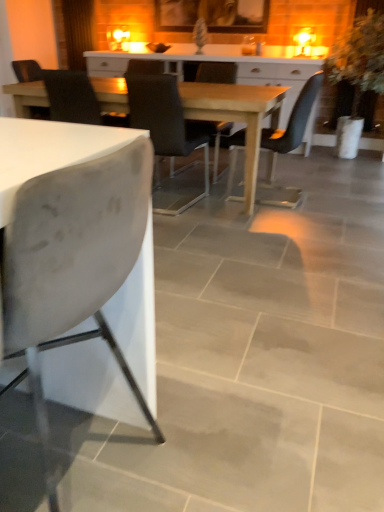
Question: From a real-world perspective, is white matte chair at left, which ranks as the 5th chair in back-to-front order, over velvet black chair at center, placed as the 4th chair when sorted from front to back?

Choices:
 (A) no
 (B) yes

Answer: (A)

Question: Is there a large distance between white matte chair at left, which ranks as the 5th chair in back-to-front order, and velvet black chair at center, placed as the 4th chair when sorted from front to back?

Choices:
 (A) no
 (B) yes

Answer: (B)

Question: From the image's perspective, does white matte chair at left, the first chair viewed from the front, appear higher than velvet black chair at center, placed as the 4th chair when sorted from front to back?

Choices:
 (A) no
 (B) yes

Answer: (A)

Question: Does white matte chair at left, the first chair viewed from the front, come behind velvet black chair at center, placed as the 4th chair when sorted from front to back?

Choices:
 (A) no
 (B) yes

Answer: (A)

Question: Could velvet black chair at center, placed as the 4th chair when sorted from front to back, be considered to be inside white matte chair at left, the first chair viewed from the front?

Choices:
 (A) no
 (B) yes

Answer: (A)

Question: Does white matte chair at left, which ranks as the 5th chair in back-to-front order, have a smaller size compared to velvet black chair at center, which is counted as the 2th chair, starting from the back?

Choices:
 (A) no
 (B) yes

Answer: (A)

Question: Considering the relative positions of velvet black chair at center, placed as the 4th chair when sorted from front to back, and matte black chair at center, which ranks as the fifth chair in front-to-back order, in the image provided, is velvet black chair at center, placed as the 4th chair when sorted from front to back, in front of matte black chair at center, which ranks as the fifth chair in front-to-back order,?

Choices:
 (A) yes
 (B) no

Answer: (A)

Question: Could you tell me if velvet black chair at center, placed as the 4th chair when sorted from front to back, is turned towards matte black chair at center, marked as the 1th chair in a back-to-front arrangement?

Choices:
 (A) yes
 (B) no

Answer: (B)

Question: Can you confirm if velvet black chair at center, placed as the 4th chair when sorted from front to back, is thinner than matte black chair at center, marked as the 1th chair in a back-to-front arrangement?

Choices:
 (A) no
 (B) yes

Answer: (B)

Question: Is velvet black chair at center, which is counted as the 2th chair, starting from the back, surrounding matte black chair at center, marked as the 1th chair in a back-to-front arrangement?

Choices:
 (A) yes
 (B) no

Answer: (B)

Question: Is velvet black chair at center, which is counted as the 2th chair, starting from the back, at the left side of matte black chair at center, which ranks as the fifth chair in front-to-back order?

Choices:
 (A) yes
 (B) no

Answer: (A)

Question: Does velvet black chair at center, placed as the 4th chair when sorted from front to back, have a smaller size compared to matte black chair at center, marked as the 1th chair in a back-to-front arrangement?

Choices:
 (A) no
 (B) yes

Answer: (B)

Question: Considering the relative sizes of green leafy plant at right and white matte chair at left, which ranks as the 5th chair in back-to-front order, in the image provided, is green leafy plant at right smaller than white matte chair at left, which ranks as the 5th chair in back-to-front order,?

Choices:
 (A) no
 (B) yes

Answer: (A)